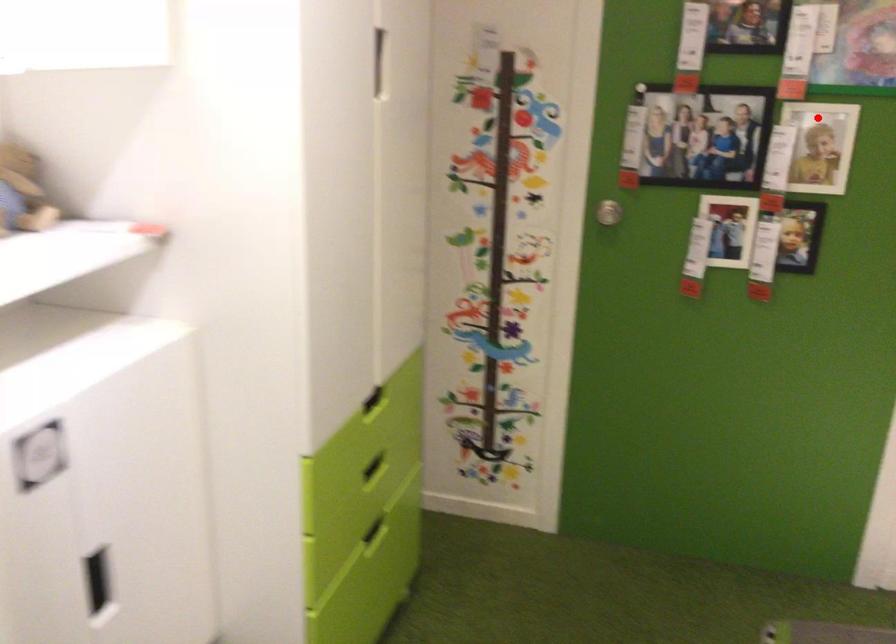
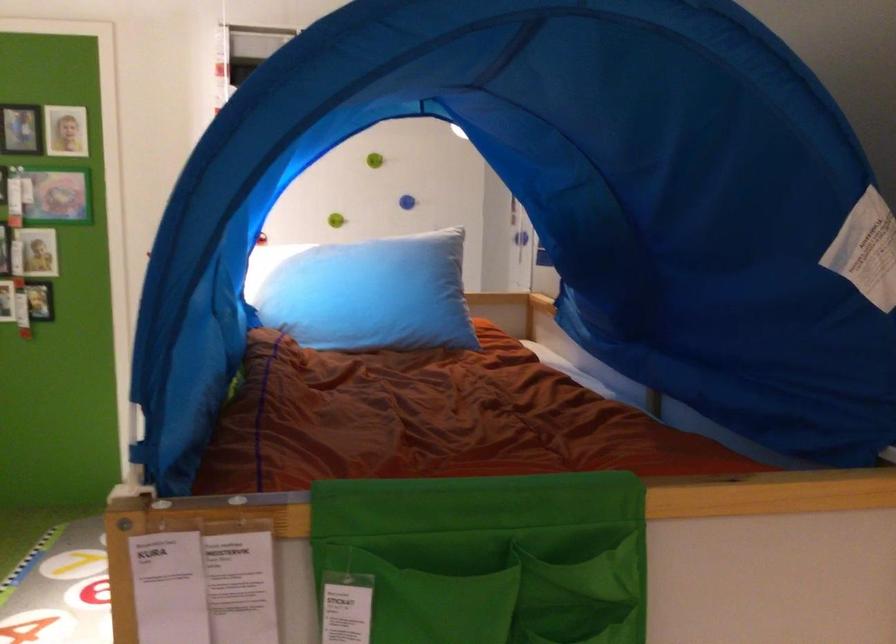
Where in the second image is the point corresponding to the highlighted location from the first image?

(39, 251)